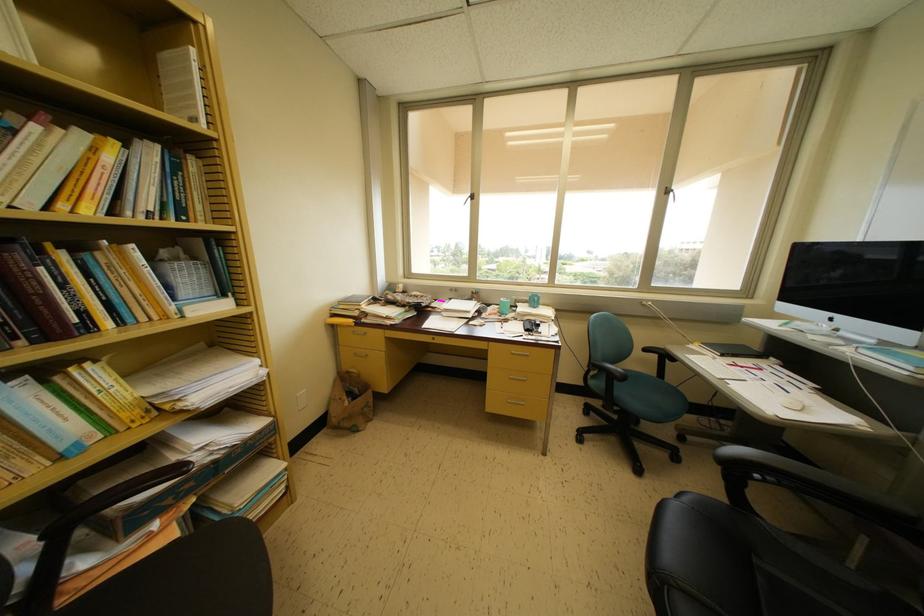
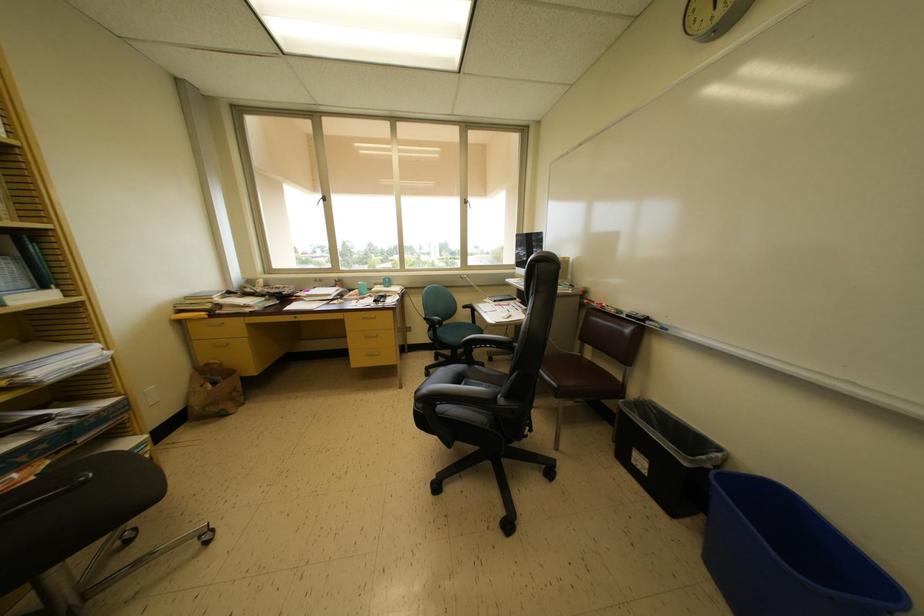
Question: The images are taken continuously from a first-person perspective. In which direction is your viewpoint rotating?

Choices:
 (A) Left
 (B) Right
 (C) Up
 (D) Down

Answer: (B)